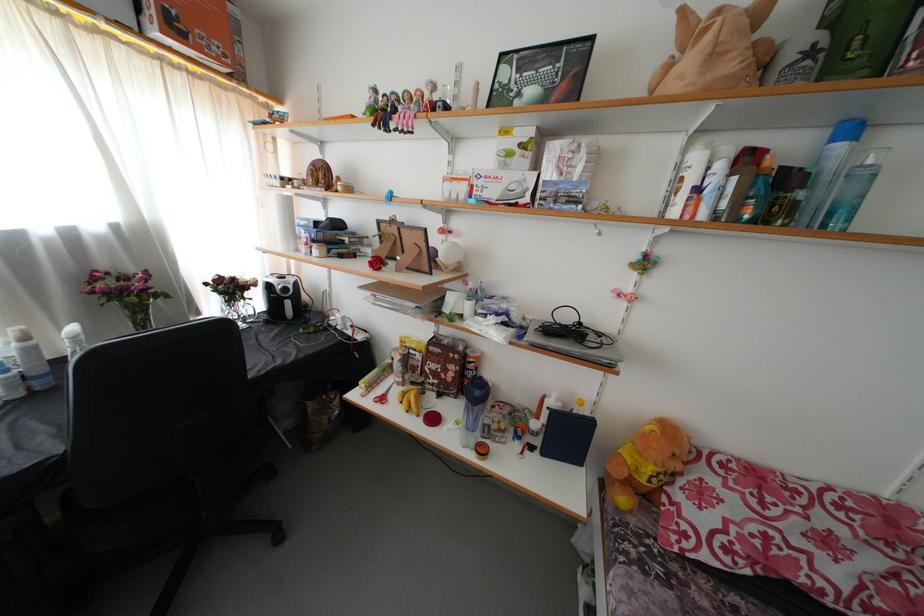
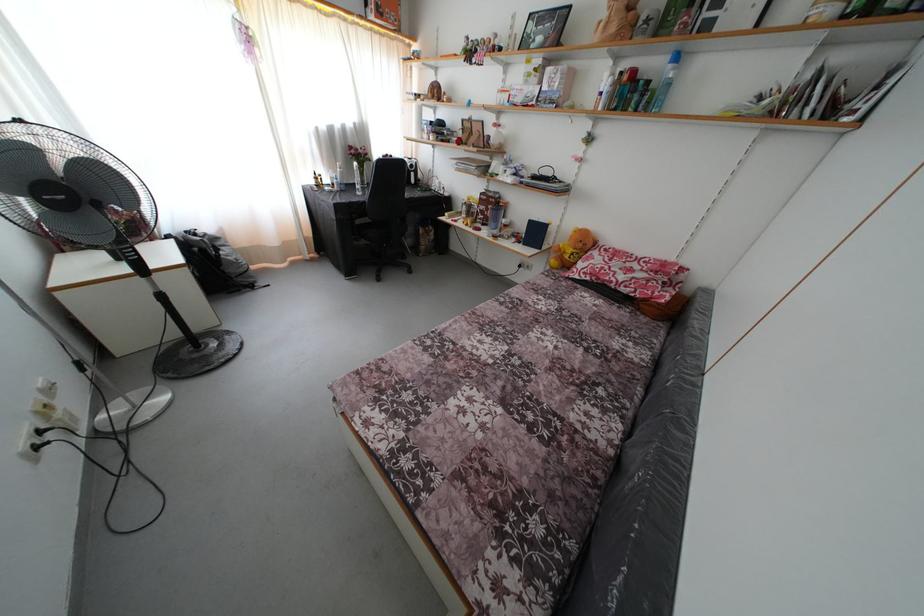
The point at (444, 400) is marked in the first image. Where is the corresponding point in the second image?

(488, 230)